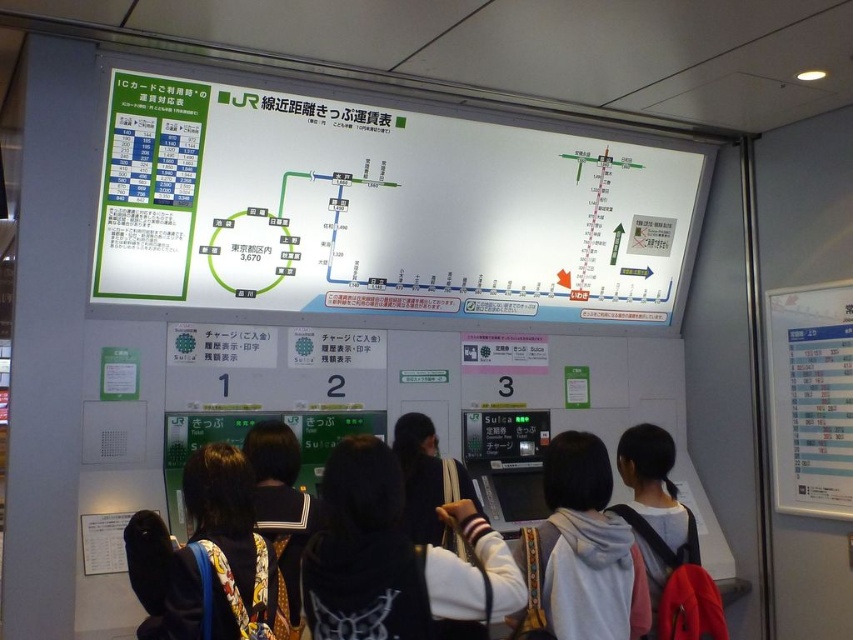
The width and height of the screenshot is (853, 640). I want to click on light gray hoodie at center, so click(x=587, y=547).

Is point (525, 577) behind point (294, 604)?

No, (525, 577) is closer to viewer.

Locate an element on the screen. light gray hoodie at center is located at coordinates (587, 547).

Can you confirm if white fabric at center is smaller than printed fabric dress at center?

Actually, white fabric at center might be larger than printed fabric dress at center.

Does white fabric at center have a greater height compared to printed fabric dress at center?

Incorrect, white fabric at center's height is not larger of printed fabric dress at center's.

You are a GUI agent. You are given a task and a screenshot of the screen. Output one action in this format:
    pyautogui.click(x=<x>, y=<y>)
    Task: Click on the white fabric at center
    The height and width of the screenshot is (640, 853).
    Given the screenshot: What is the action you would take?
    pyautogui.click(x=393, y=557)

You are a GUI agent. You are given a task and a screenshot of the screen. Output one action in this format:
    pyautogui.click(x=<x>, y=<y>)
    Task: Click on the white fabric at center
    
    Given the screenshot: What is the action you would take?
    pyautogui.click(x=393, y=557)

Describe the element at coordinates (393, 557) in the screenshot. I see `white fabric at center` at that location.

Between white fabric at center and dark blue backpack at center, which one appears on the right side from the viewer's perspective?

From the viewer's perspective, white fabric at center appears more on the right side.

Is point (344, 458) less distant than point (190, 534)?

Yes, point (344, 458) is closer to viewer.

The width and height of the screenshot is (853, 640). I want to click on white fabric at center, so click(393, 557).